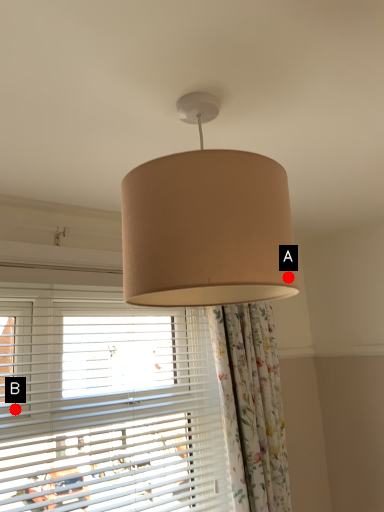
Question: Two points are circled on the image, labeled by A and B beside each circle. Which point is further to the camera?

Choices:
 (A) A is further
 (B) B is further

Answer: (B)